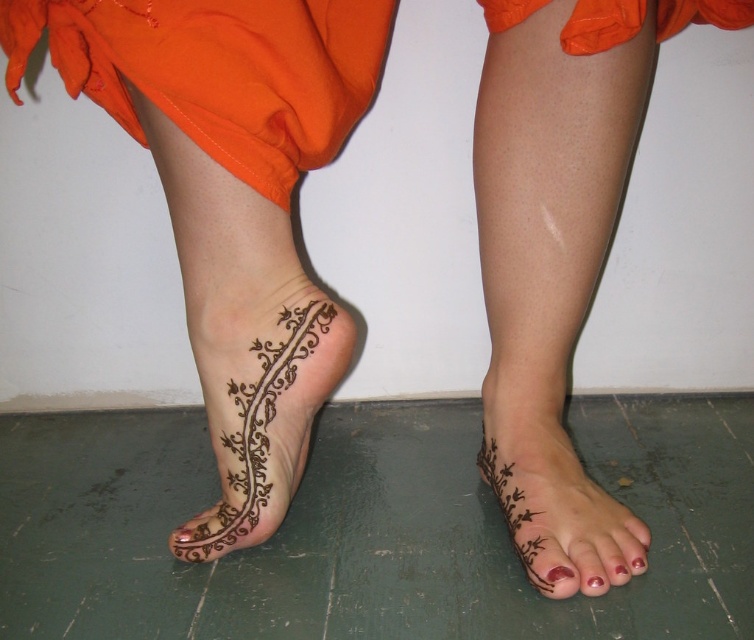
Does brown henna tattoo at lower left appear on the right side of brown henna tattoo at lower center?

Incorrect, brown henna tattoo at lower left is not on the right side of brown henna tattoo at lower center.

Does point (253, 534) come farther from viewer compared to point (495, 486)?

That is False.

Which is behind, point (250, 310) or point (562, 512)?

The point (562, 512) is more distant.

The image size is (754, 640). Find the location of `brown henna tattoo at lower left`. brown henna tattoo at lower left is located at coordinates (x=259, y=410).

Between point (244, 518) and point (590, 534), which one is positioned behind?

Point (244, 518)

Which is above, brown henna tattoo at lower left or glossy red nail polish at lower center?

Positioned higher is brown henna tattoo at lower left.

Between point (293, 364) and point (589, 566), which one is positioned behind?

Positioned behind is point (293, 364).

Image resolution: width=754 pixels, height=640 pixels. Identify the location of brown henna tattoo at lower left. (259, 410).

Is the position of brown henna tattoo at lower center more distant than that of glossy red nail polish at lower center?

No, brown henna tattoo at lower center is closer to the viewer.

Which of these two, brown henna tattoo at lower center or glossy red nail polish at lower center, stands taller?

brown henna tattoo at lower center

Between point (503, 412) and point (590, 588), which one is positioned in front?

Point (590, 588)

Locate an element on the screen. Image resolution: width=754 pixels, height=640 pixels. brown henna tattoo at lower center is located at coordinates (556, 504).